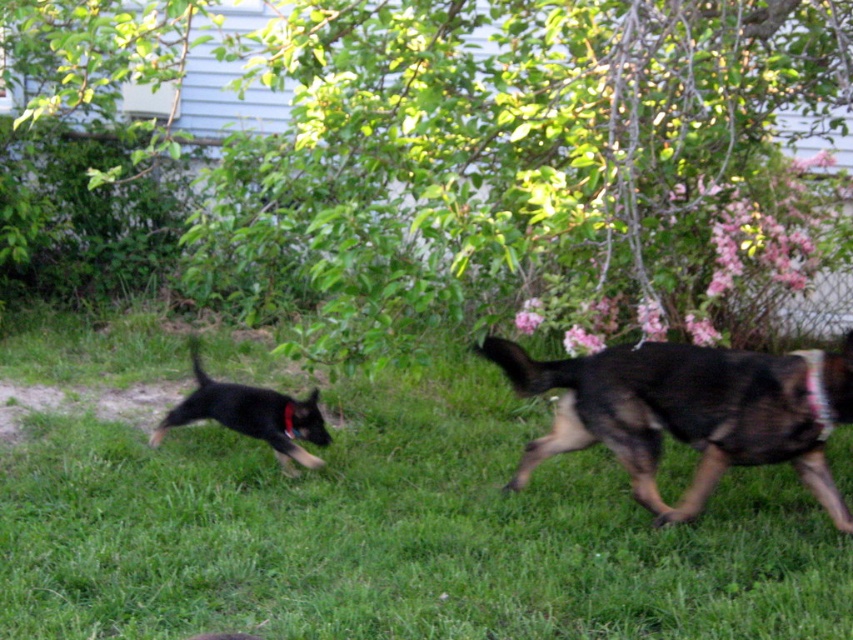
In the scene shown: Who is taller, green grass at center or black fur dog at right?

With more height is green grass at center.

What do you see at coordinates (396, 532) in the screenshot? I see `green grass at center` at bounding box center [396, 532].

At what (x,y) coordinates should I click in order to perform the action: click on green grass at center. Please return your answer as a coordinate pair (x, y). Looking at the image, I should click on (396, 532).

Who is higher up, green grass at center or black glossy dog at left?

black glossy dog at left is above.

Which is in front, point (511, 410) or point (202, 396)?

Point (202, 396) is in front.

What do you see at coordinates (396, 532) in the screenshot?
I see `green grass at center` at bounding box center [396, 532].

Locate an element on the screen. This screenshot has height=640, width=853. green grass at center is located at coordinates pos(396,532).

Is the position of black glossy dog at left less distant than that of red fabric neckband at right?

That is False.

Is black glossy dog at left to the right of red fabric neckband at right from the viewer's perspective?

Incorrect, black glossy dog at left is not on the right side of red fabric neckband at right.

Does point (262, 435) come farther from viewer compared to point (822, 396)?

Yes, point (262, 435) is farther from viewer.

Find the location of `black glossy dog at left`. black glossy dog at left is located at coordinates (251, 416).